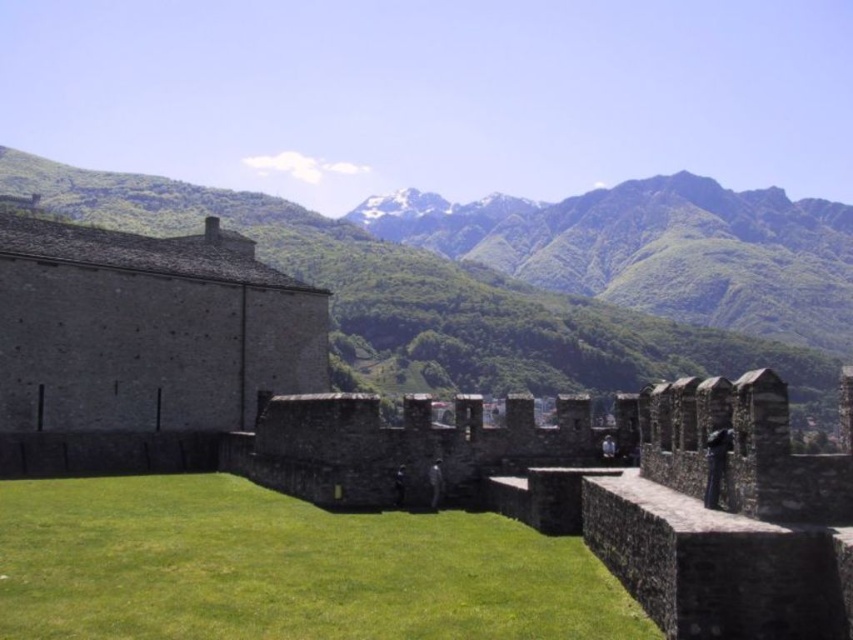
Is point (762, 369) closer to camera compared to point (706, 372)?

That is True.

Who is more forward, (468, 408) or (531, 356)?

Point (468, 408)

Locate an element on the screen. This screenshot has height=640, width=853. brown stone wall at center is located at coordinates (618, 493).

Which is more to the left, green grass at center or brown stone wall at center?

green grass at center is more to the left.

Which is behind, point (469, 620) or point (686, 378)?

Positioned behind is point (686, 378).

The height and width of the screenshot is (640, 853). What do you see at coordinates (283, 568) in the screenshot? I see `green grass at center` at bounding box center [283, 568].

The width and height of the screenshot is (853, 640). I want to click on green grass at center, so click(283, 568).

Can you confirm if green grass at center is positioned to the right of green leafy mountain at upper center?

Indeed, green grass at center is positioned on the right side of green leafy mountain at upper center.

Does point (376, 600) come in front of point (386, 336)?

Yes, it is.

You are a GUI agent. You are given a task and a screenshot of the screen. Output one action in this format:
    pyautogui.click(x=<x>, y=<y>)
    Task: Click on the green grass at center
    
    Given the screenshot: What is the action you would take?
    pyautogui.click(x=283, y=568)